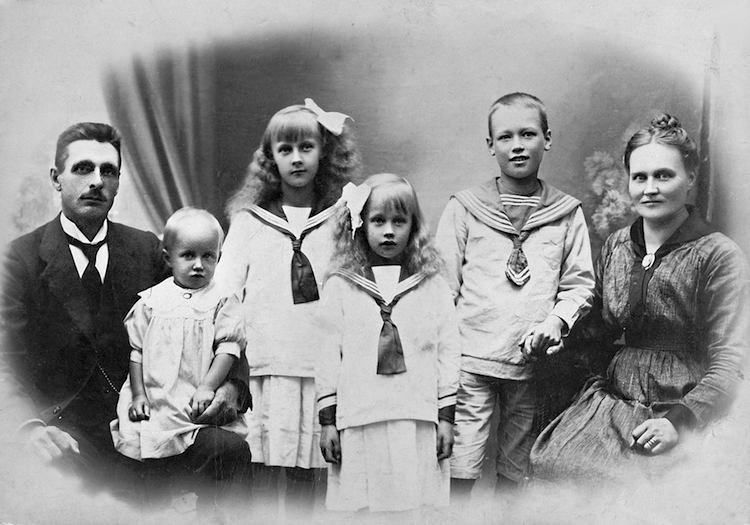
Locate an element on the screen. The width and height of the screenshot is (750, 525). grey wall is located at coordinates (31, 72), (703, 28).